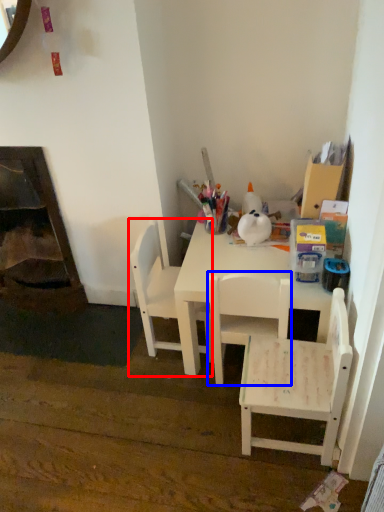
Question: Which point is further to the camera, chair (highlighted by a red box) or chair (highlighted by a blue box)?

Choices:
 (A) chair
 (B) chair

Answer: (A)